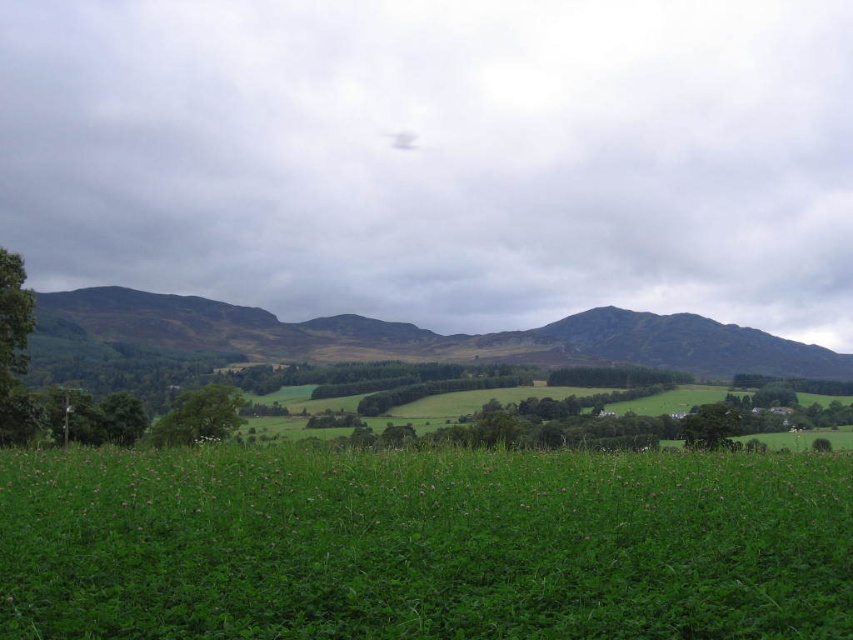
Question: Which of the following is the closest to the observer?

Choices:
 (A) rugged brown mountain at center
 (B) white fluffy cloud at upper center
 (C) green grassy field at center

Answer: (C)

Question: Can you confirm if white fluffy cloud at upper center is smaller than green grassy field at center?

Choices:
 (A) yes
 (B) no

Answer: (B)

Question: Which object appears closest to the camera in this image?

Choices:
 (A) white fluffy cloud at upper center
 (B) rugged brown mountain at center

Answer: (B)

Question: Which object appears farthest from the camera in this image?

Choices:
 (A) rugged brown mountain at center
 (B) green grassy field at center

Answer: (A)

Question: Is green grassy field at center behind rugged brown mountain at center?

Choices:
 (A) yes
 (B) no

Answer: (B)

Question: Is green grassy field at center to the right of rugged brown mountain at center from the viewer's perspective?

Choices:
 (A) no
 (B) yes

Answer: (A)